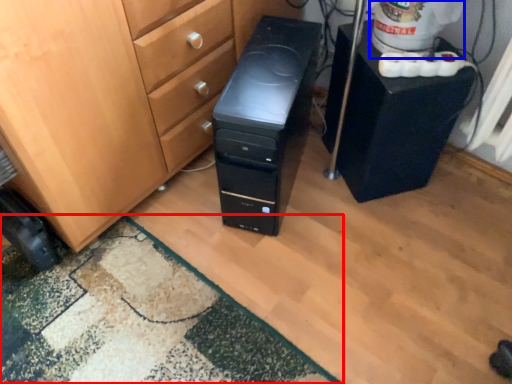
Question: Among these objects, which one is farthest to the camera, doormat (highlighted by a red box) or water cooler (highlighted by a blue box)?

Choices:
 (A) doormat
 (B) water cooler

Answer: (B)